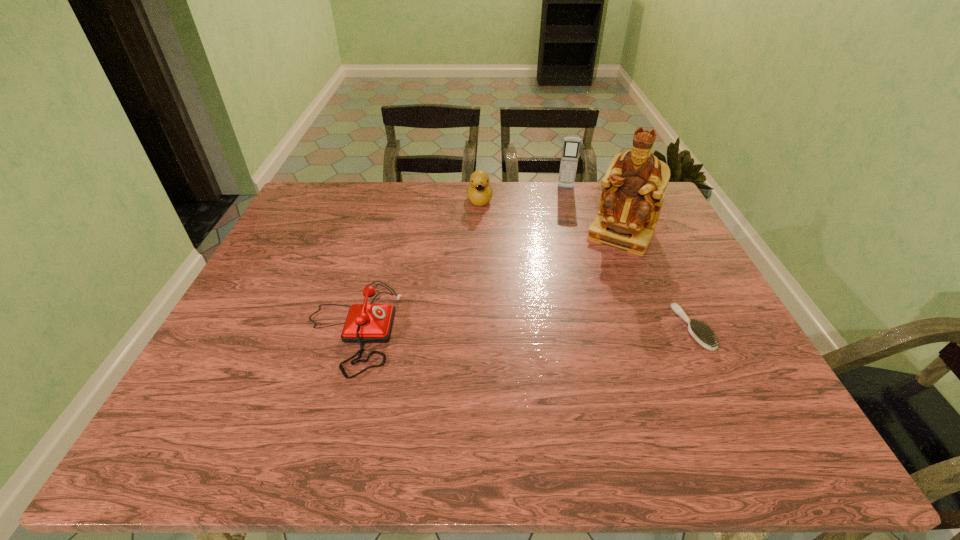
At what (x,y) coordinates should I click in order to perform the action: click on vacant point located between the fourth shortest object and the telephone. Please return your answer as a coordinate pair (x, y). The width and height of the screenshot is (960, 540). Looking at the image, I should click on (459, 258).

Locate an element on the screen. This screenshot has height=540, width=960. object that is the fourth closest to the duckling is located at coordinates (703, 335).

Locate an element on the screen. Image resolution: width=960 pixels, height=540 pixels. the third closest object relative to the cellular telephone is located at coordinates (703, 335).

I want to click on vacant space that satisfies the following two spatial constraints: 1. on the front side of the fourth shortest object; 2. on the right side of the tallest object, so click(x=579, y=235).

Find the location of `blank space that satisfies the following two spatial constraints: 1. on the back side of the fourth shortest object; 2. on the left side of the duckling`. blank space that satisfies the following two spatial constraints: 1. on the back side of the fourth shortest object; 2. on the left side of the duckling is located at coordinates (480, 188).

Locate an element on the screen. The width and height of the screenshot is (960, 540). free location that satisfies the following two spatial constraints: 1. on the front side of the cellular telephone; 2. on the left side of the figurine is located at coordinates (579, 235).

Identify the location of free region that satisfies the following two spatial constraints: 1. on the front side of the third nearest object; 2. on the left side of the cellular telephone. (579, 235).